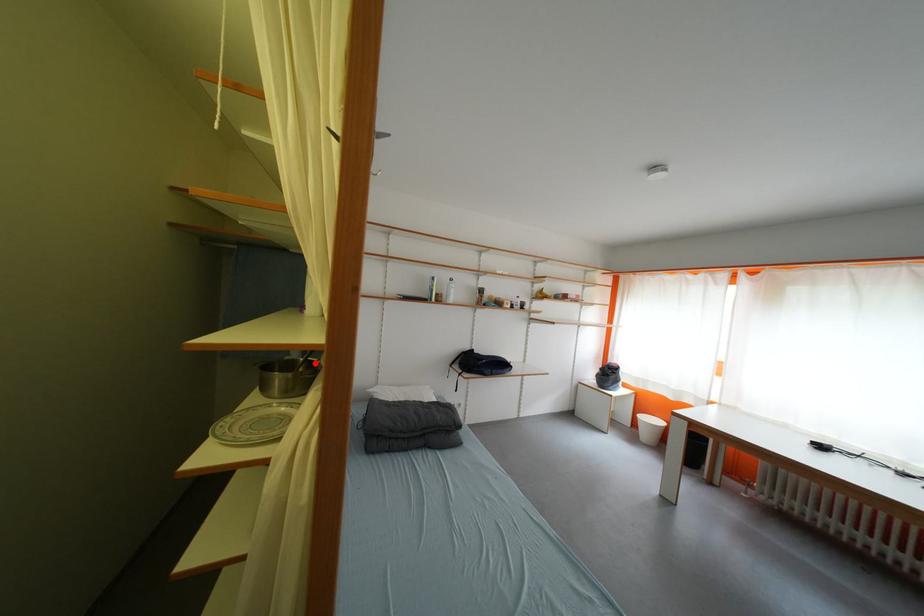
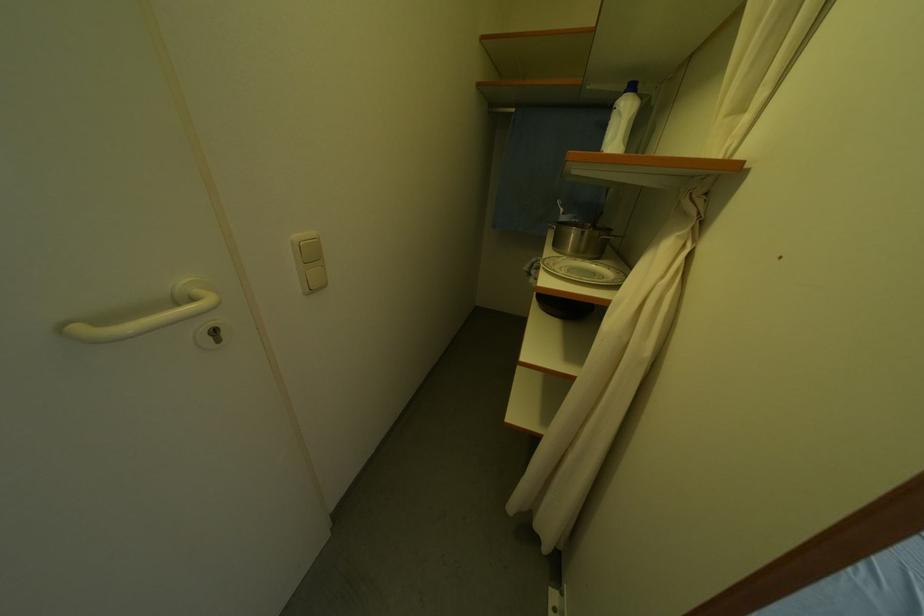
Where in the second image is the point corresponding to the highlighted location from the first image?

(602, 228)